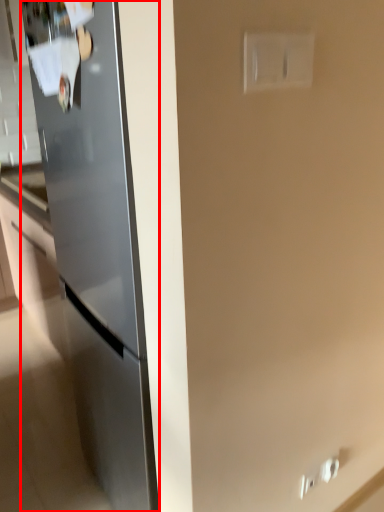
Question: From the image's perspective, what is the correct spatial positioning of refrigerator (annotated by the red box) in reference to electric outlet?

Choices:
 (A) below
 (B) above

Answer: (A)